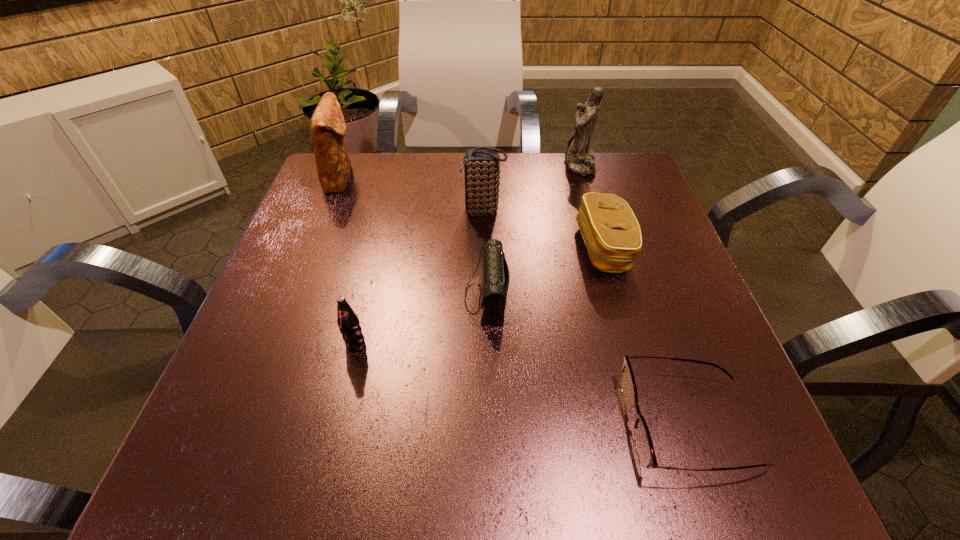
I want to click on unoccupied area between the pop and the farthest clutch bag, so click(x=348, y=261).

Identify the location of free spot between the rightmost clutch bag and the sixth farthest object. (480, 296).

Where is `vacant space that's between the second nearest object and the rightmost clutch bag`? This screenshot has width=960, height=540. vacant space that's between the second nearest object and the rightmost clutch bag is located at coordinates (480, 296).

Identify which object is located as the fifth nearest to the rightmost clutch bag. Please provide its 2D coordinates. Your answer should be formatted as a tuple, i.e. [(x, y)], where the tuple contains the x and y coordinates of a point satisfying the conditions above.

[(349, 325)]

This screenshot has width=960, height=540. Find the location of `the second closest object to the spectacles`. the second closest object to the spectacles is located at coordinates (611, 232).

Locate an element on the screen. The width and height of the screenshot is (960, 540). the third closest clutch bag to the spectacles is located at coordinates (482, 167).

Identify which clutch bag is the fourth closest to the sixth object from right to left. Please provide its 2D coordinates. Your answer should be formatted as a tuple, i.e. [(x, y)], where the tuple contains the x and y coordinates of a point satisfying the conditions above.

[(611, 232)]